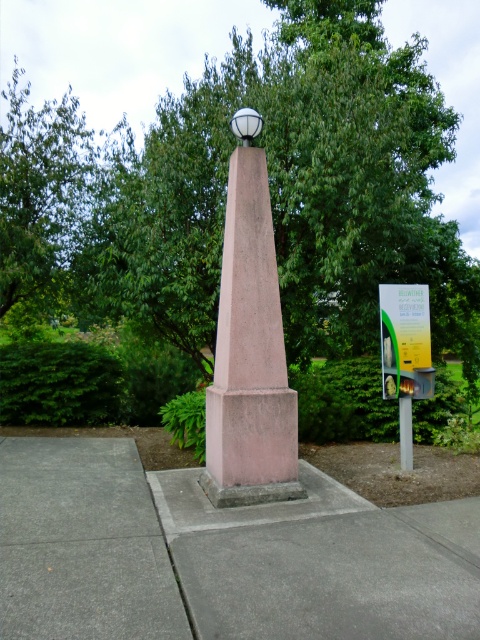
You are planning to plant a new tree in the park. You notice the green leafy tree at center and the gray concrete pavement at center. Which area has more space available for planting a new tree?

The gray concrete pavement at center has more space available because the green leafy tree at center occupies less space than the gray concrete pavement at center.

You are standing in a park and see the green leafy tree at center and the gray concrete pavement at center. Which one is closer to you?

The green leafy tree at center is closer to you than the gray concrete pavement at center.